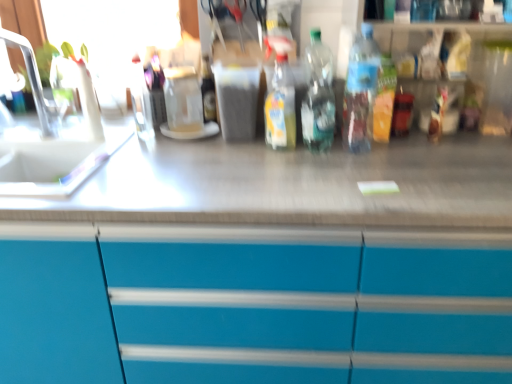
Question: Can you confirm if clear plastic bottle at upper center, marked as the 1th bottle in a left-to-right arrangement, is wider than translucent plastic bottle at center, positioned as the 1th bottle in right-to-left order?

Choices:
 (A) yes
 (B) no

Answer: (B)

Question: Can you confirm if clear plastic bottle at upper center, the fourth bottle when ordered from right to left, is bigger than translucent plastic bottle at center, positioned as the 1th bottle in right-to-left order?

Choices:
 (A) no
 (B) yes

Answer: (A)

Question: Can you confirm if clear plastic bottle at upper center, marked as the 1th bottle in a left-to-right arrangement, is positioned to the right of translucent plastic bottle at center, positioned as the 1th bottle in right-to-left order?

Choices:
 (A) yes
 (B) no

Answer: (B)

Question: Is clear plastic bottle at upper center, marked as the 1th bottle in a left-to-right arrangement, located outside translucent plastic bottle at center, positioned as the 1th bottle in right-to-left order?

Choices:
 (A) yes
 (B) no

Answer: (A)

Question: Does clear plastic bottle at upper center, the fourth bottle when ordered from right to left, have a lesser height compared to translucent plastic bottle at center, positioned as the 1th bottle in right-to-left order?

Choices:
 (A) yes
 (B) no

Answer: (A)

Question: Is clear plastic bottle at upper center, the fourth bottle when ordered from right to left, far away from translucent plastic bottle at center, positioned as the 1th bottle in right-to-left order?

Choices:
 (A) no
 (B) yes

Answer: (A)

Question: Is translucent plastic bottle at center, the 3th bottle positioned from the right, a part of white plastic faucet at left?

Choices:
 (A) no
 (B) yes

Answer: (A)

Question: Are white plastic faucet at left and translucent plastic bottle at center, the 3th bottle positioned from the right, far apart?

Choices:
 (A) yes
 (B) no

Answer: (B)

Question: From the image's perspective, is white plastic faucet at left beneath translucent plastic bottle at center, which is the 2th bottle from left to right?

Choices:
 (A) yes
 (B) no

Answer: (B)

Question: Can we say white plastic faucet at left lies outside translucent plastic bottle at center, the 3th bottle positioned from the right?

Choices:
 (A) no
 (B) yes

Answer: (B)

Question: Can you confirm if white plastic faucet at left is wider than translucent plastic bottle at center, the 3th bottle positioned from the right?

Choices:
 (A) yes
 (B) no

Answer: (A)

Question: Is white plastic faucet at left oriented away from translucent plastic bottle at center, which is the 2th bottle from left to right?

Choices:
 (A) no
 (B) yes

Answer: (A)

Question: From the image's perspective, would you say translucent plastic bottle at center, the 3th bottle positioned from the right, is positioned over white plastic faucet at left?

Choices:
 (A) no
 (B) yes

Answer: (A)